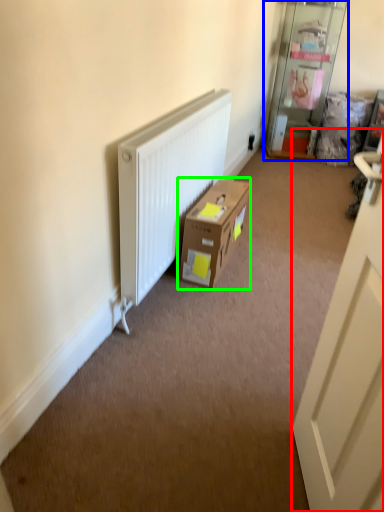
Question: Considering the real-world distances, which object is farthest from door (highlighted by a red box)? shelf (highlighted by a blue box) or box (highlighted by a green box)?

Choices:
 (A) shelf
 (B) box

Answer: (A)